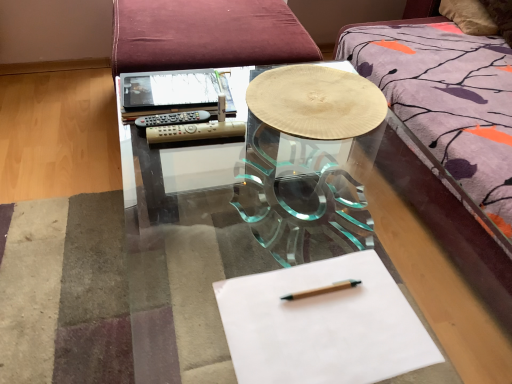
This screenshot has width=512, height=384. Find the location of `free space in front of wooden pencil at center`. free space in front of wooden pencil at center is located at coordinates (320, 348).